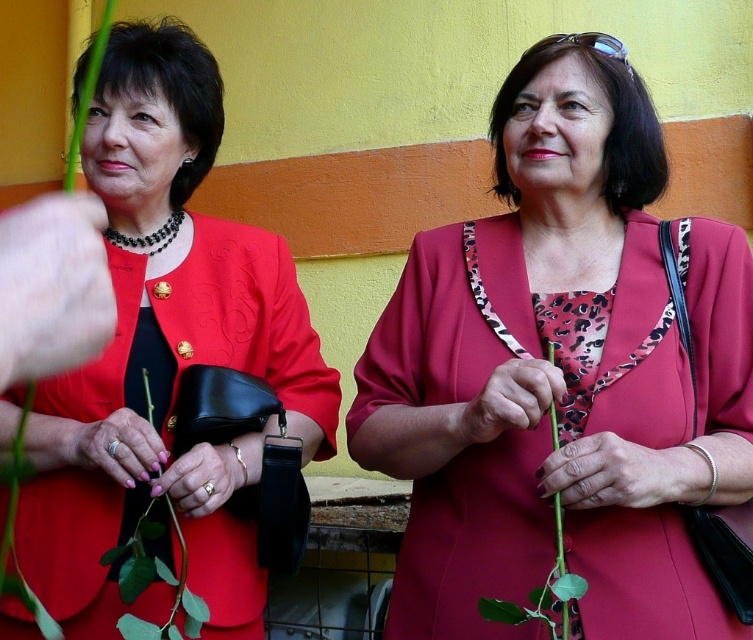
Question: Is matte red dress at center below matte black dress at left?

Choices:
 (A) no
 (B) yes

Answer: (B)

Question: Which point is farther to the camera?

Choices:
 (A) (191, 604)
 (B) (483, 605)
 (C) (157, 284)
 (D) (495, 456)

Answer: (C)

Question: Estimate the real-world distances between objects in this image. Which object is farther from the green matte flower at center?

Choices:
 (A) matte black dress at left
 (B) green stem at center
 (C) green matte plant at center
 (D) matte red dress at center

Answer: (B)

Question: Which object is farther from the camera taking this photo?

Choices:
 (A) matte red dress at center
 (B) matte black dress at left

Answer: (B)

Question: Can you confirm if matte black dress at left is positioned below green matte flower at center?

Choices:
 (A) no
 (B) yes

Answer: (B)

Question: Can you confirm if matte red dress at center is positioned to the left of matte black dress at left?

Choices:
 (A) no
 (B) yes

Answer: (A)